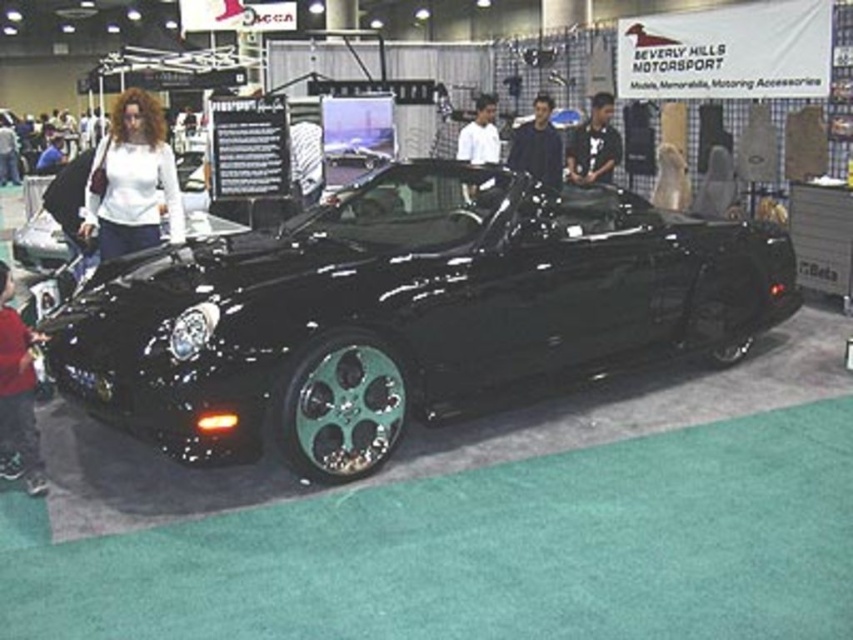
You are at an auto show and see a black leather jacket displayed at upper center. Is the point at coordinate (593, 145) on this jacket?

Yes, the point at coordinate (593, 145) is on the black leather jacket at upper center.

You are a fashion designer who wants to place a black leather jacket at upper center and a white matte shirt at center in a photo shoot. The venue is the auto show described. The camera is positioned to capture both items. If the minimum distance required between the two items for proper framing is 5 feet, will the current placement work?

The black leather jacket at upper center is 4.56 feet from the white matte shirt at center. Since the required distance is 5 feet, the current placement is insufficient and the items are too close to meet the framing requirement.